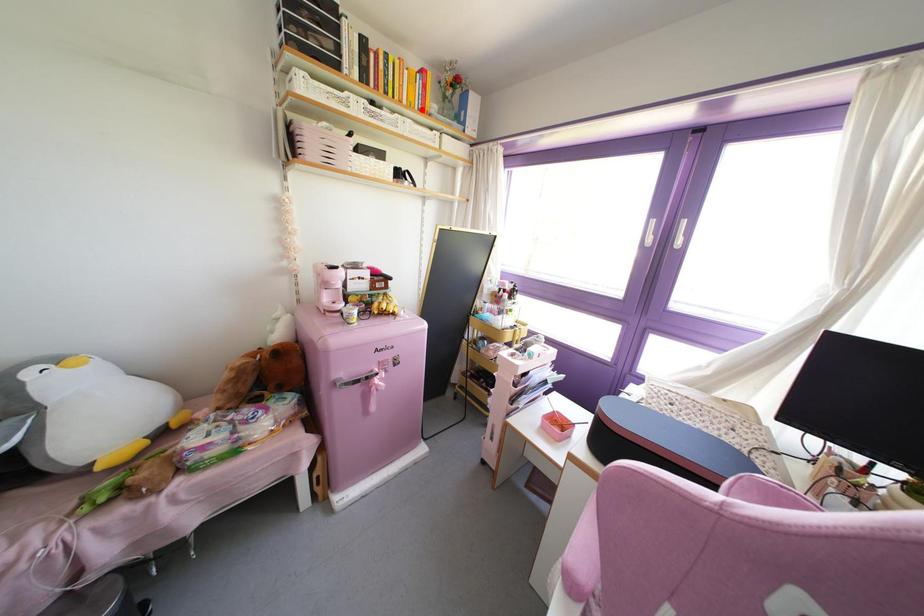
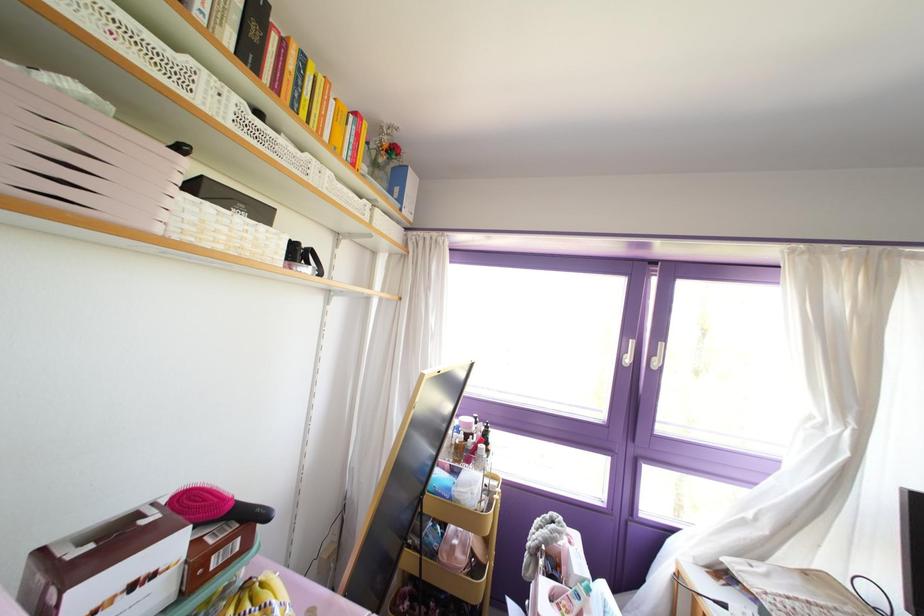
Locate, in the second image, the point that corresponds to the highlighted location in the first image.

(351, 164)